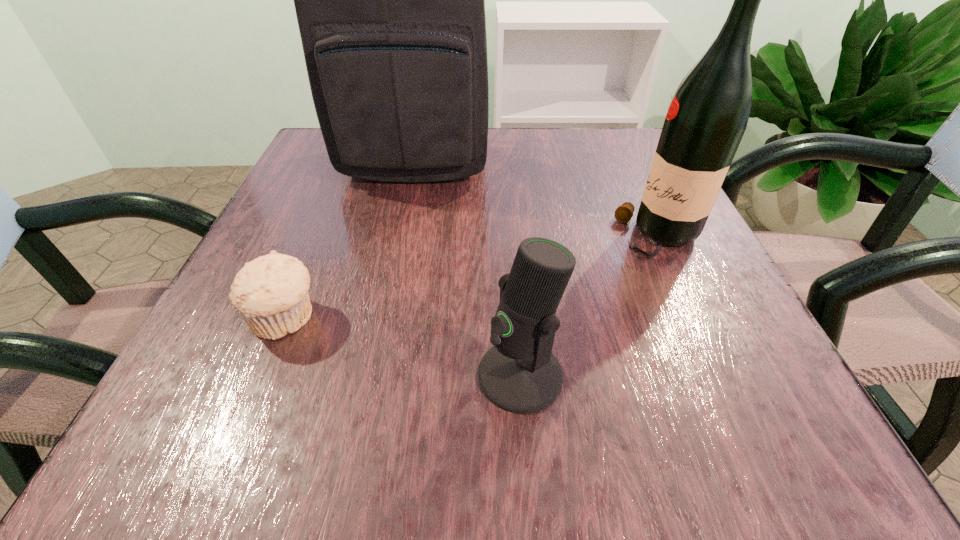
Find the location of a particular element. vacant space at the near left corner of the desktop is located at coordinates (168, 426).

Find the location of a particular element. vacant area that lies between the microphone and the muffin is located at coordinates (402, 347).

At what (x,y) coordinates should I click in order to perform the action: click on free space between the shortest object and the farthest object. Please return your answer as a coordinate pair (x, y). Looking at the image, I should click on (350, 241).

Locate an element on the screen. The image size is (960, 540). empty space that is in between the muffin and the second shortest object is located at coordinates (402, 347).

The width and height of the screenshot is (960, 540). Identify the location of empty space between the rightmost object and the muffin. (472, 278).

Find the location of a particular element. free space between the second tallest object and the backpack is located at coordinates (538, 199).

Where is `vacant region between the third tallest object and the muffin`? The width and height of the screenshot is (960, 540). vacant region between the third tallest object and the muffin is located at coordinates (402, 347).

The width and height of the screenshot is (960, 540). I want to click on vacant region between the shortest object and the third shortest object, so click(472, 278).

Identify the location of vacant space that's between the muffin and the wine bottle. (472, 278).

Identify the location of empty space between the wine bottle and the second shortest object. (589, 306).